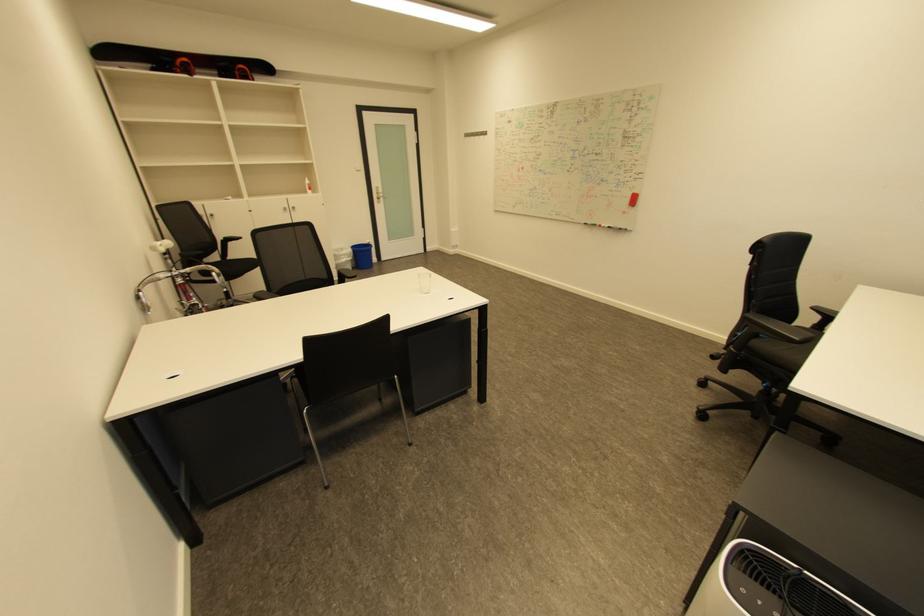
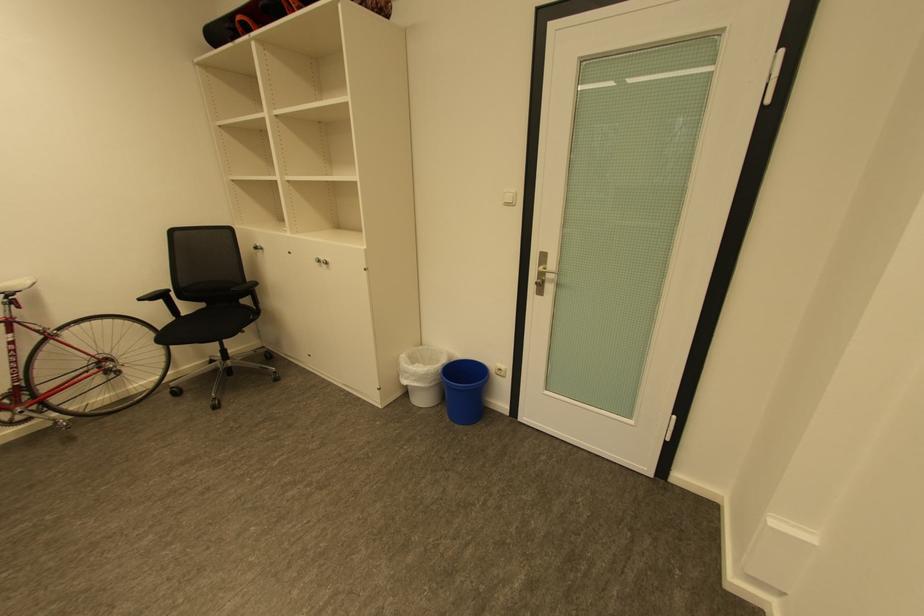
Where in the second image is the point corresponding to (x=349, y=256) from the first image?

(414, 373)